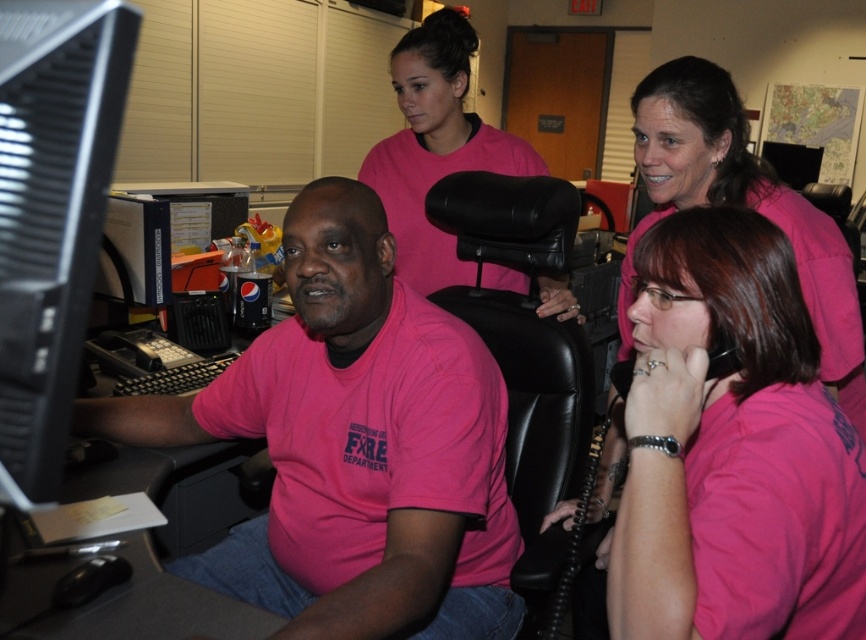
Does point (518, 564) lie in front of point (404, 248)?

Yes, it is.

Is point (444, 220) more distant than point (462, 24)?

No, it is not.

Is point (532, 509) farther from camera compared to point (470, 124)?

No, it is in front of (470, 124).

Locate an element on the screen. The width and height of the screenshot is (866, 640). black leather swivel chair at center is located at coordinates (528, 364).

Is point (39, 406) in front of point (556, 346)?

Yes, it is in front of point (556, 346).

Can you confirm if black plastic monitor at left is positioned to the left of black leather swivel chair at center?

Correct, you'll find black plastic monitor at left to the left of black leather swivel chair at center.

Does point (46, 10) come behind point (530, 522)?

No, (46, 10) is closer to viewer.

The image size is (866, 640). Identify the location of black plastic monitor at left. (50, 214).

Can you confirm if pink matte shirt at lower right is smaller than matte pink shirt at upper center?

Indeed, pink matte shirt at lower right has a smaller size compared to matte pink shirt at upper center.

Which is in front, point (805, 493) or point (423, 77)?

Point (805, 493) is more forward.

Where is `pink matte shirt at lower right`? The image size is (866, 640). pink matte shirt at lower right is located at coordinates (734, 449).